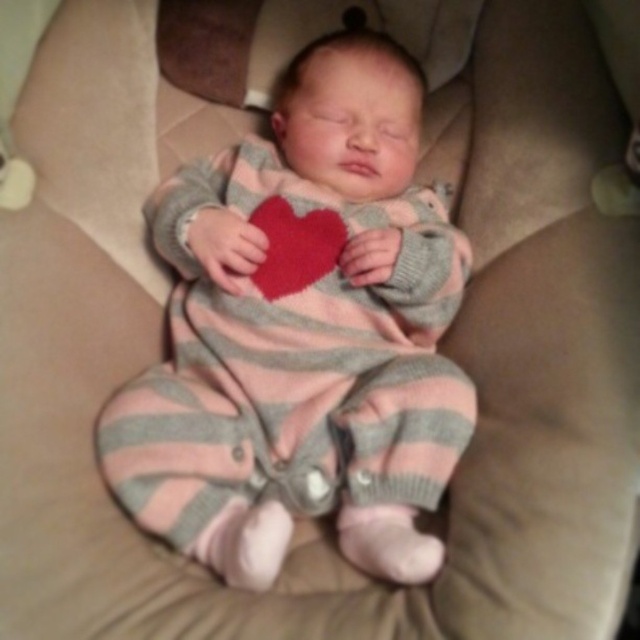
Is knitted pink-gray baby at center shorter than matte red heart at center?

No, knitted pink-gray baby at center is not shorter than matte red heart at center.

Is the position of knitted pink-gray baby at center less distant than that of matte red heart at center?

Yes.

Image resolution: width=640 pixels, height=640 pixels. Describe the element at coordinates (301, 333) in the screenshot. I see `knitted pink-gray baby at center` at that location.

Find the location of a particular element. knitted pink-gray baby at center is located at coordinates (301, 333).